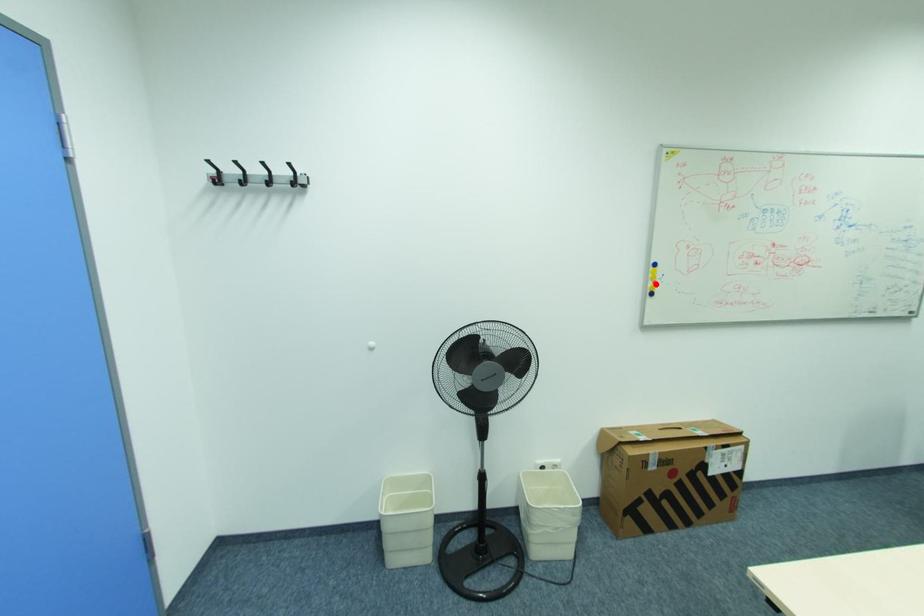
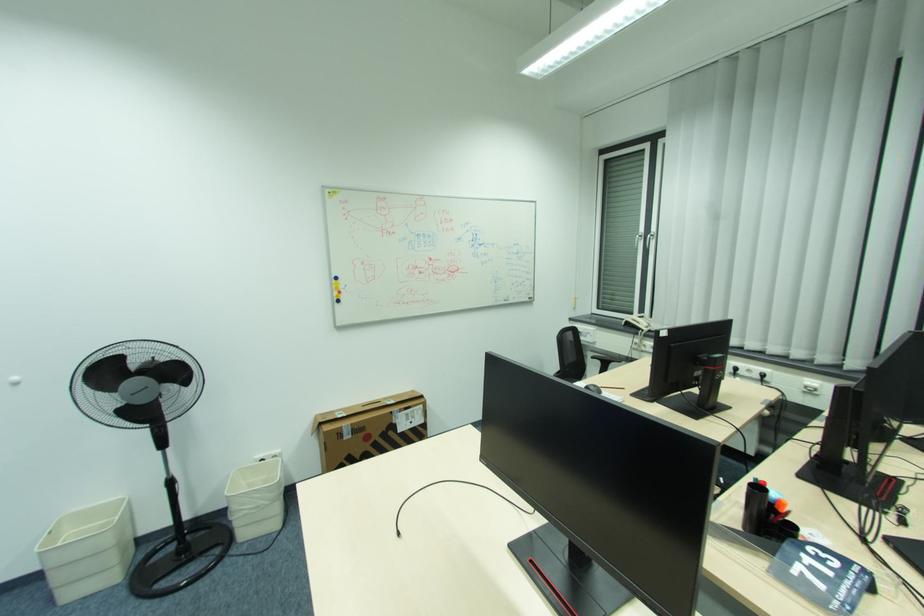
Locate, in the second image, the point that corresponds to the highlighted location in the first image.

(341, 294)